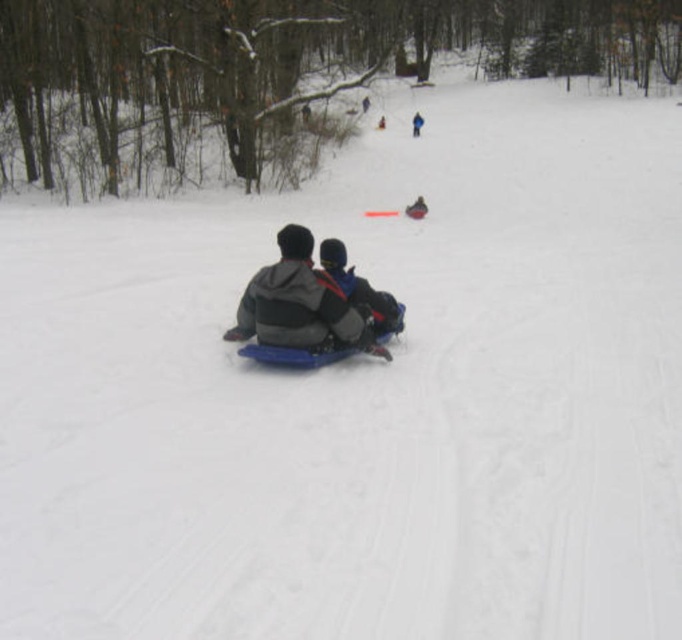
Question: Does blue plastic sled at center appear on the right side of dark blue fabric jacket at center?

Choices:
 (A) yes
 (B) no

Answer: (B)

Question: Which point is closer to the camera taking this photo?

Choices:
 (A) (413, 131)
 (B) (424, 205)
 (C) (329, 262)
 (D) (306, 234)

Answer: (D)

Question: Which is nearer to the dark gray fleece jacket at center?

Choices:
 (A) blue fabric jacket at center
 (B) blue plastic sled at center

Answer: (B)

Question: Which of the following is the closest to the observer?

Choices:
 (A) blue fabric jacket at center
 (B) dark blue fabric jacket at center
 (C) blue plastic sled at center
 (D) dark gray fleece jacket at center

Answer: (C)

Question: Does blue plastic sled at center have a greater width compared to blue fabric jacket at center?

Choices:
 (A) yes
 (B) no

Answer: (A)

Question: Is dark gray fleece jacket at center thinner than blue fabric jacket at center?

Choices:
 (A) yes
 (B) no

Answer: (A)